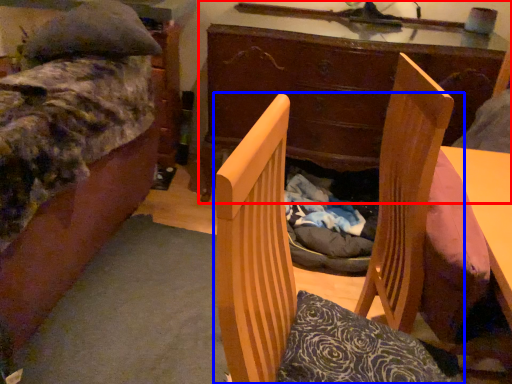
Question: Which of the following is the farthest to the observer, desk (highlighted by a red box) or chair (highlighted by a blue box)?

Choices:
 (A) desk
 (B) chair

Answer: (A)